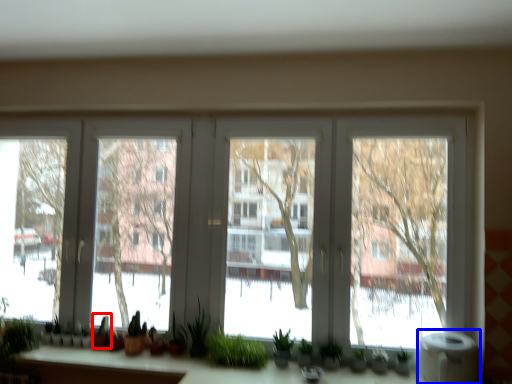
Question: Which object is further to the camera taking this photo, plant (highlighted by a red box) or water heater (highlighted by a blue box)?

Choices:
 (A) plant
 (B) water heater

Answer: (A)